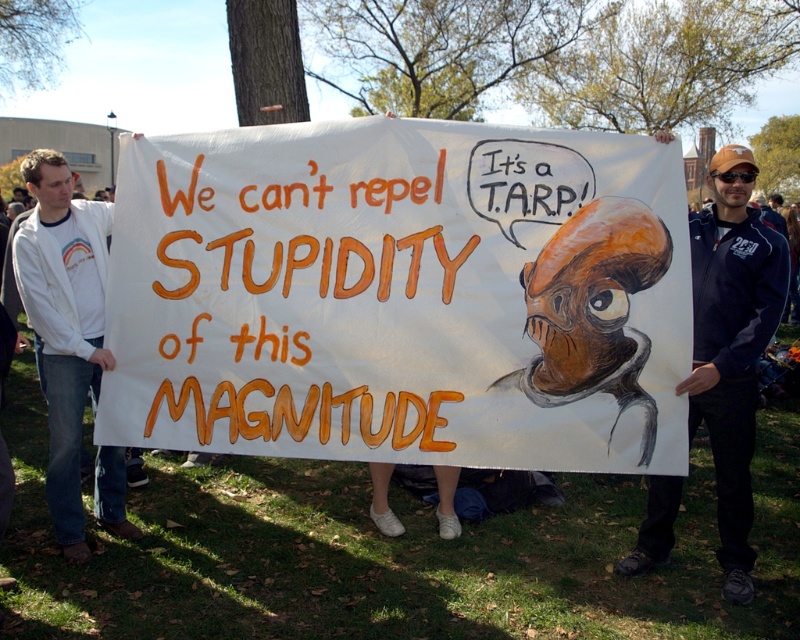
Question: In this image, where is white paper banner at center located relative to dark blue jacket at center?

Choices:
 (A) left
 (B) right

Answer: (A)

Question: Which point is farther to the camera?

Choices:
 (A) white paper banner at center
 (B) white cotton jacket at left

Answer: (B)

Question: Is white paper banner at center positioned at the back of dark blue jacket at center?

Choices:
 (A) no
 (B) yes

Answer: (A)

Question: Which point appears closest to the camera in this image?

Choices:
 (A) (744, 250)
 (B) (108, 468)
 (C) (678, 460)

Answer: (C)

Question: Which is nearer to the white paper banner at center?

Choices:
 (A) dark blue jacket at center
 (B) white cotton jacket at left

Answer: (A)

Question: Does white paper banner at center have a smaller size compared to white cotton jacket at left?

Choices:
 (A) no
 (B) yes

Answer: (A)